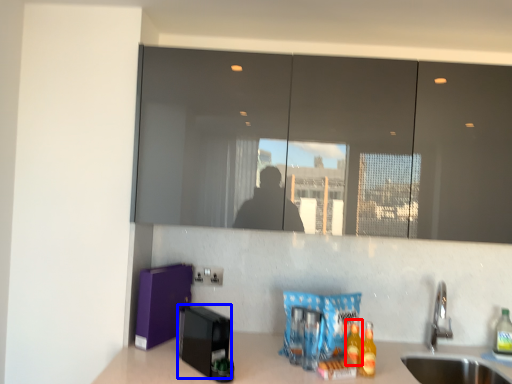
Question: Which of the following is the closest to the observer, beverage (highlighted by a red box) or appliance (highlighted by a blue box)?

Choices:
 (A) beverage
 (B) appliance

Answer: (B)